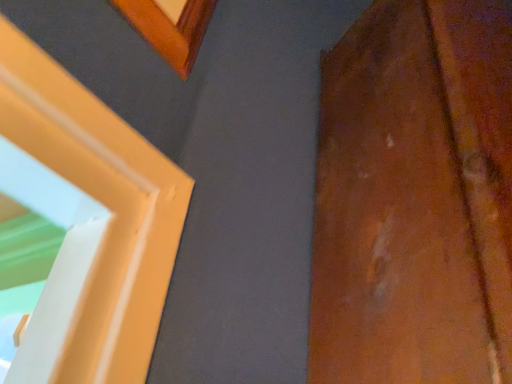
You are a GUI agent. You are given a task and a screenshot of the screen. Output one action in this format:
    pyautogui.click(x=<x>, y=<y>)
    Task: Click on the wooden door at right
    This screenshot has width=512, height=384.
    Given the screenshot: What is the action you would take?
    [x=415, y=198]

Describe the element at coordinates (415, 198) in the screenshot. I see `wooden door at right` at that location.

Identify the location of wooden door at right. The width and height of the screenshot is (512, 384). (415, 198).